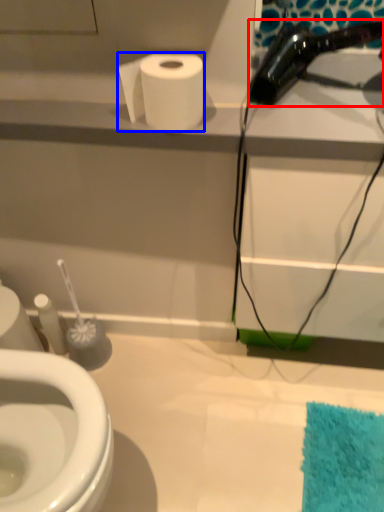
Question: Which object is further to the camera taking this photo, hair drier (highlighted by a red box) or toilet paper (highlighted by a blue box)?

Choices:
 (A) hair drier
 (B) toilet paper

Answer: (B)